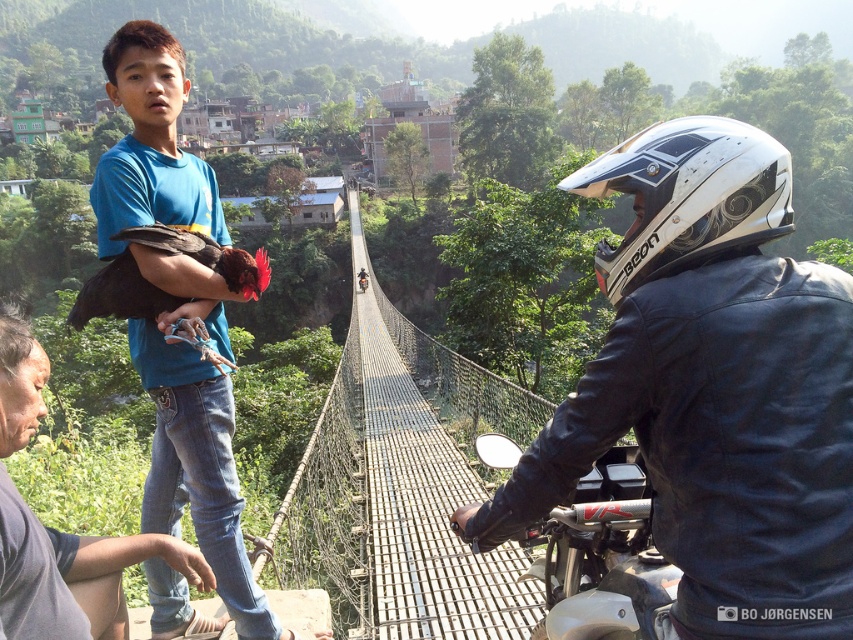
Does metallic wire mesh bridge at center have a smaller size compared to blue cotton shirt at upper left?

Actually, metallic wire mesh bridge at center might be larger than blue cotton shirt at upper left.

The image size is (853, 640). In order to click on metallic wire mesh bridge at center in this screenshot , I will do `click(405, 483)`.

Does blue cotton shirt at upper left have a smaller size compared to white matte motorcycle at center?

No, blue cotton shirt at upper left is not smaller than white matte motorcycle at center.

Which is more to the right, blue cotton shirt at upper left or white matte motorcycle at center?

white matte motorcycle at center is more to the right.

What do you see at coordinates (196, 438) in the screenshot? I see `blue cotton shirt at upper left` at bounding box center [196, 438].

I want to click on blue cotton shirt at upper left, so 196,438.

Who is taller, white glossy helmet at upper right or white matte motorcycle at center?

Standing taller between the two is white glossy helmet at upper right.

Image resolution: width=853 pixels, height=640 pixels. What do you see at coordinates (688, 196) in the screenshot?
I see `white glossy helmet at upper right` at bounding box center [688, 196].

At what (x,y) coordinates should I click in order to perform the action: click on white glossy helmet at upper right. Please return your answer as a coordinate pair (x, y). Looking at the image, I should click on (688, 196).